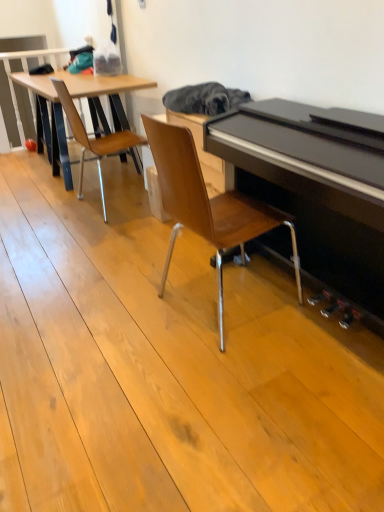
What are the coordinates of `vacant area that is in front of wooden chair at left, the second chair positioned from the front` in the screenshot? It's located at (85, 233).